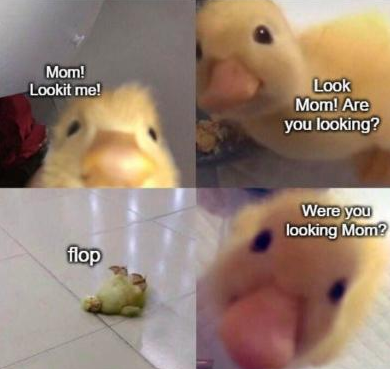
I want to click on white wall, so click(150, 45).